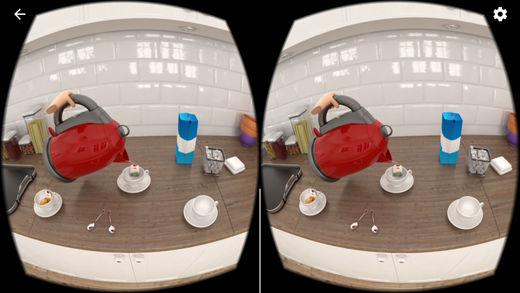
You are a GUI agent. You are given a task and a screenshot of the screen. Output one action in this format:
    pyautogui.click(x=<x>, y=<y>)
    Task: Click on the countertop
    
    Given the screenshot: What is the action you would take?
    pyautogui.click(x=159, y=218), pyautogui.click(x=409, y=229)